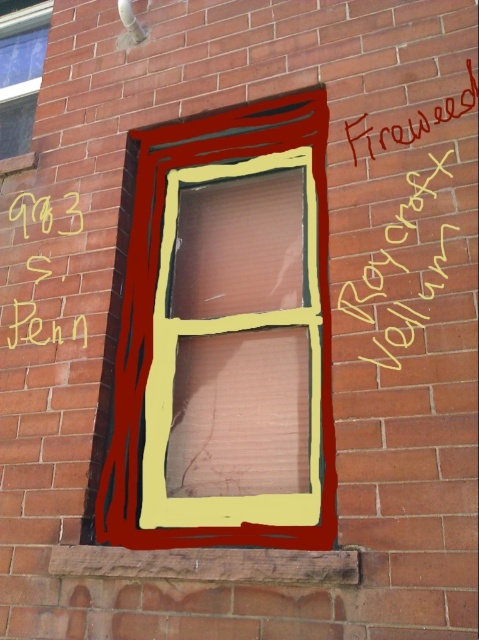
You are standing in front of a brick wall with a digitally drawn window. There is a point marked at coordinates (226,337). Which object does this point belong to?

The point at coordinates (226,337) is on the wooden window frame at center.

You are standing in front of a brick wall with a digitally drawn window. There is a point marked at coordinates point (417,227). If you want to touch this point with a 5 foot long stick, will the stick reach it?

The point (417,227) is 4.81 feet from the camera, so yes, the 5 foot long stick will reach it.